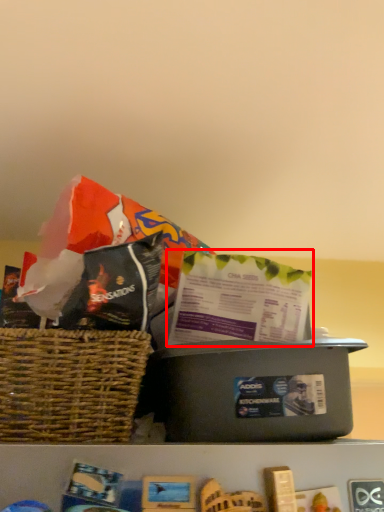
Question: From the image's perspective, where is gift bag (annotated by the red box) located relative to box?

Choices:
 (A) below
 (B) above

Answer: (B)